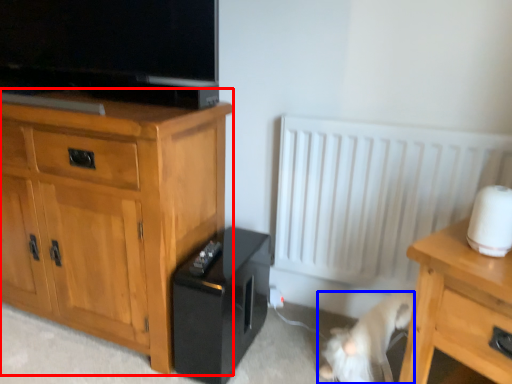
Question: Which object is further to the camera taking this photo, chest of drawers (highlighted by a red box) or animal (highlighted by a blue box)?

Choices:
 (A) chest of drawers
 (B) animal

Answer: (B)